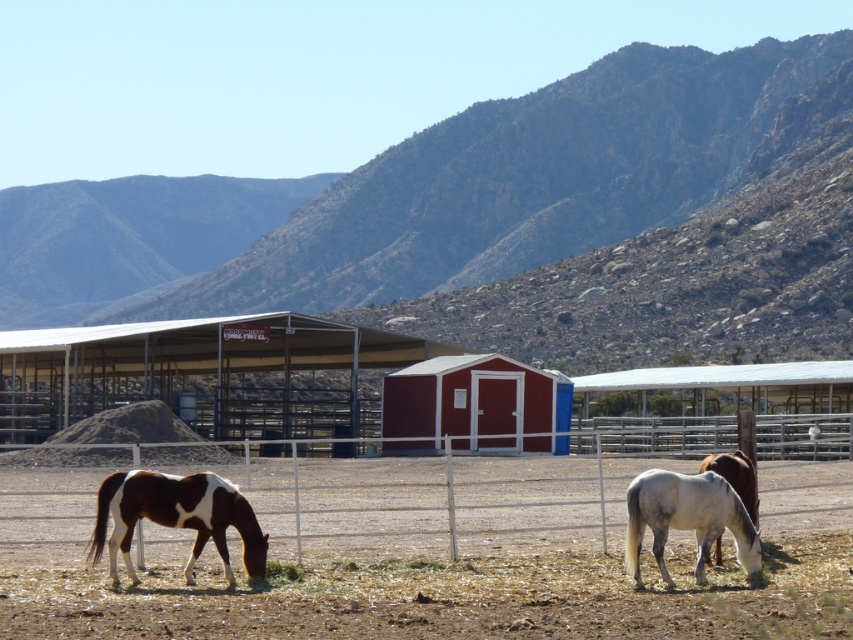
Question: Which point is closer to the camera?

Choices:
 (A) brown and white speckled horse at lower left
 (B) white matte horse at lower right
 (C) smooth red shed at center

Answer: (A)

Question: Does brown and white speckled horse at lower left have a smaller size compared to white glossy horse at lower right?

Choices:
 (A) no
 (B) yes

Answer: (A)

Question: Considering the real-world distances, which object is farthest from the white matte horse at lower right?

Choices:
 (A) white glossy horse at lower right
 (B) smooth red shed at center

Answer: (B)

Question: Which object is farther from the camera taking this photo?

Choices:
 (A) white matte horse at lower right
 (B) white glossy horse at lower right
 (C) smooth red shed at center

Answer: (C)

Question: Observing the image, what is the correct spatial positioning of white matte horse at lower right in reference to white glossy horse at lower right?

Choices:
 (A) right
 (B) left

Answer: (B)

Question: Does brown and white speckled horse at lower left appear on the right side of white glossy horse at lower right?

Choices:
 (A) yes
 (B) no

Answer: (B)